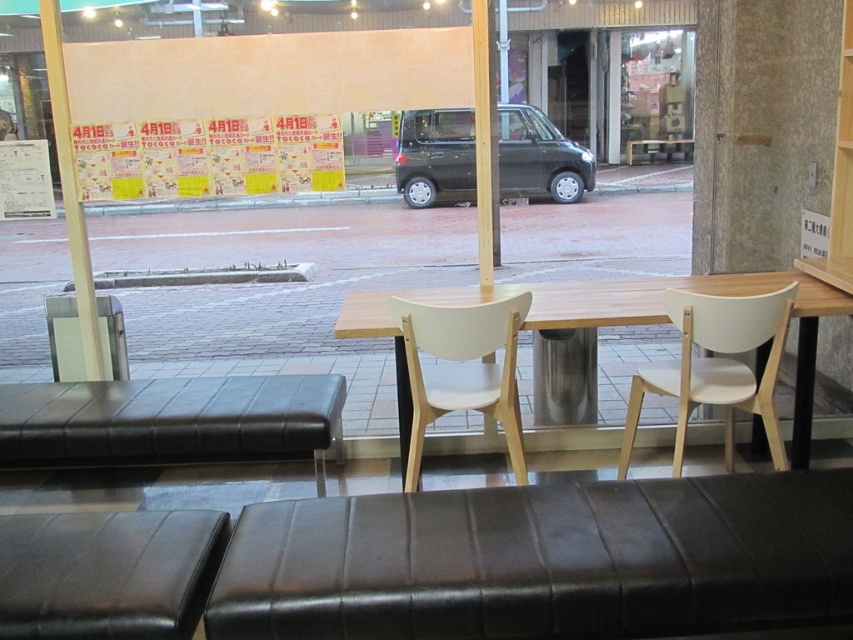
Question: Which object is closer to the camera taking this photo?

Choices:
 (A) light wood table at center
 (B) white matte chair at center
 (C) black leather hassock at center
 (D) black leather bench at lower left

Answer: (B)

Question: Observing the image, what is the correct spatial positioning of black leather bench at lower left in reference to white wood chair at right?

Choices:
 (A) below
 (B) above

Answer: (A)

Question: Which point is closer to the camera taking this photo?

Choices:
 (A) (729, 445)
 (B) (770, 365)
 (C) (625, 147)

Answer: (B)

Question: Can you confirm if white matte chair at center is positioned to the left of transparent glass window at center?

Choices:
 (A) yes
 (B) no

Answer: (A)

Question: Which point is farther to the camera?

Choices:
 (A) (631, 54)
 (B) (512, 118)
 (C) (193, 449)

Answer: (A)

Question: Is black leather bench at lower left wider than black leather hassock at center?

Choices:
 (A) yes
 (B) no

Answer: (B)